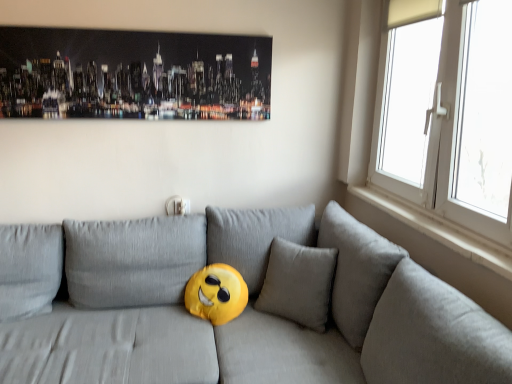
Where is `white smooth window sill at right`? The height and width of the screenshot is (384, 512). white smooth window sill at right is located at coordinates (439, 229).

Locate an element on the screen. white plastic window at right is located at coordinates (448, 113).

Looking at this image, is metallic cityscape art at upper center at the left side of white smooth window sill at right?

Yes, metallic cityscape art at upper center is to the left of white smooth window sill at right.

Based on their sizes in the image, would you say metallic cityscape art at upper center is bigger or smaller than white smooth window sill at right?

In the image, metallic cityscape art at upper center appears to be larger than white smooth window sill at right.

Would you say metallic cityscape art at upper center contains white smooth window sill at right?

No, white smooth window sill at right is not inside metallic cityscape art at upper center.

Are metallic cityscape art at upper center and matte gray couch at center located far from each other?

metallic cityscape art at upper center is actually quite close to matte gray couch at center.

Consider the image. Is metallic cityscape art at upper center further to the viewer compared to matte gray couch at center?

That is True.

Considering the sizes of objects metallic cityscape art at upper center and matte gray couch at center in the image provided, who is smaller, metallic cityscape art at upper center or matte gray couch at center?

With smaller size is metallic cityscape art at upper center.

Looking at this image, considering the relative positions of metallic cityscape art at upper center and white plastic window at right in the image provided, is metallic cityscape art at upper center to the right of white plastic window at right from the viewer's perspective?

In fact, metallic cityscape art at upper center is to the left of white plastic window at right.

Is metallic cityscape art at upper center far from white plastic window at right?

Absolutely, metallic cityscape art at upper center is distant from white plastic window at right.

Which of these two, metallic cityscape art at upper center or white plastic window at right, is bigger?

white plastic window at right is bigger.

Which of these two, metallic cityscape art at upper center or white plastic window at right, is thinner?

With smaller width is metallic cityscape art at upper center.

From the image's perspective, which one is positioned lower, matte gray couch at center or metallic cityscape art at upper center?

matte gray couch at center.

Find the location of a particular element. Image resolution: width=512 pixels, height=384 pixels. studio couch on the right of metallic cityscape art at upper center is located at coordinates (233, 302).

Is matte gray couch at center shorter than metallic cityscape art at upper center?

No, matte gray couch at center is not shorter than metallic cityscape art at upper center.

From a real-world perspective, is matte gray couch at center physically located above or below metallic cityscape art at upper center?

Clearly, from a real-world perspective, matte gray couch at center is below metallic cityscape art at upper center.

How different are the orientations of white plastic window at right and white smooth window sill at right in degrees?

white plastic window at right and white smooth window sill at right are facing 0.247 degrees away from each other.

Considering the positions of objects white plastic window at right and white smooth window sill at right in the image provided, who is more to the left, white plastic window at right or white smooth window sill at right?

white smooth window sill at right.

Can you confirm if white plastic window at right is thinner than white smooth window sill at right?

No, white plastic window at right is not thinner than white smooth window sill at right.

From a real-world perspective, between white plastic window at right and white smooth window sill at right, who is vertically lower?

white smooth window sill at right, from a real-world perspective.

Which object is positioned more to the left, white plastic window at right or metallic cityscape art at upper center?

metallic cityscape art at upper center.

Between white plastic window at right and metallic cityscape art at upper center, which one has more height?

With more height is white plastic window at right.

From a real-world perspective, does white plastic window at right stand above metallic cityscape art at upper center?

Incorrect, from a real-world perspective, white plastic window at right is lower than metallic cityscape art at upper center.

Does white plastic window at right have a larger size compared to metallic cityscape art at upper center?

Correct, white plastic window at right is larger in size than metallic cityscape art at upper center.

Could you tell me if matte gray couch at center is turned towards white plastic window at right?

No, matte gray couch at center is not oriented towards white plastic window at right.

Looking at this image, which of these two, matte gray couch at center or white plastic window at right, is bigger?

matte gray couch at center.

Does matte gray couch at center have a lesser width compared to white plastic window at right?

No, matte gray couch at center is not thinner than white plastic window at right.

Identify the location of window sill lying on the right of metallic cityscape art at upper center. The width and height of the screenshot is (512, 384). (439, 229).

Where is `picture frame above the matte gray couch at center (from a real-world perspective)`? picture frame above the matte gray couch at center (from a real-world perspective) is located at coordinates coord(133,75).

Considering their positions, is matte gray couch at center positioned further to white smooth window sill at right than metallic cityscape art at upper center?

Based on the image, metallic cityscape art at upper center appears to be further to white smooth window sill at right.

From the image, which object appears to be nearer to matte gray couch at center, metallic cityscape art at upper center or white smooth window sill at right?

white smooth window sill at right is closer to matte gray couch at center.

Based on the photo, looking at the image, which one is located further to matte gray couch at center, white plastic window at right or metallic cityscape art at upper center?

metallic cityscape art at upper center lies further to matte gray couch at center than the other object.

When comparing their distances from matte gray couch at center, does metallic cityscape art at upper center or white plastic window at right seem further?

metallic cityscape art at upper center is positioned further to the anchor matte gray couch at center.

From the image, which object appears to be farther from white smooth window sill at right, metallic cityscape art at upper center or white plastic window at right?

Based on the image, metallic cityscape art at upper center appears to be further to white smooth window sill at right.

Which object lies nearer to the anchor point metallic cityscape art at upper center, white plastic window at right or white smooth window sill at right?

white plastic window at right.

When comparing their distances from white plastic window at right, does metallic cityscape art at upper center or matte gray couch at center seem closer?

matte gray couch at center lies closer to white plastic window at right than the other object.

Considering their positions, is matte gray couch at center positioned further to metallic cityscape art at upper center than white plastic window at right?

Among the two, white plastic window at right is located further to metallic cityscape art at upper center.

Locate an element on the screen. window sill between metallic cityscape art at upper center and white plastic window at right in the horizontal direction is located at coordinates (439, 229).

At what (x,y) coordinates should I click in order to perform the action: click on window sill located between matte gray couch at center and white plastic window at right in the left-right direction. Please return your answer as a coordinate pair (x, y). Looking at the image, I should click on (439, 229).

The image size is (512, 384). Identify the location of window sill located between matte gray couch at center and metallic cityscape art at upper center in the depth direction. (439, 229).

The height and width of the screenshot is (384, 512). I want to click on window between matte gray couch at center and metallic cityscape art at upper center along the z-axis, so click(x=448, y=113).